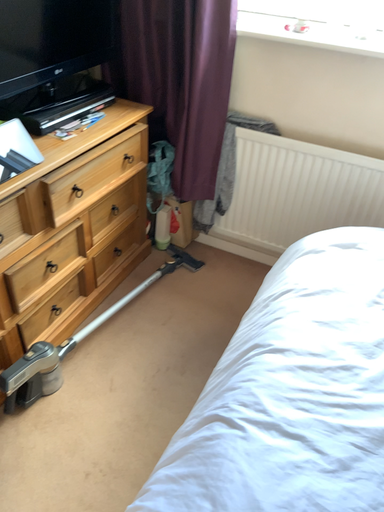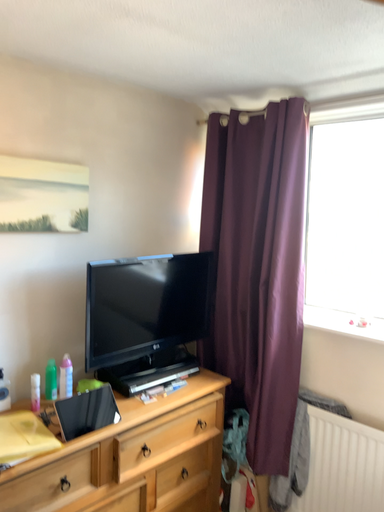
Question: How did the camera likely rotate when shooting the video?

Choices:
 (A) rotated downward
 (B) rotated upward

Answer: (B)